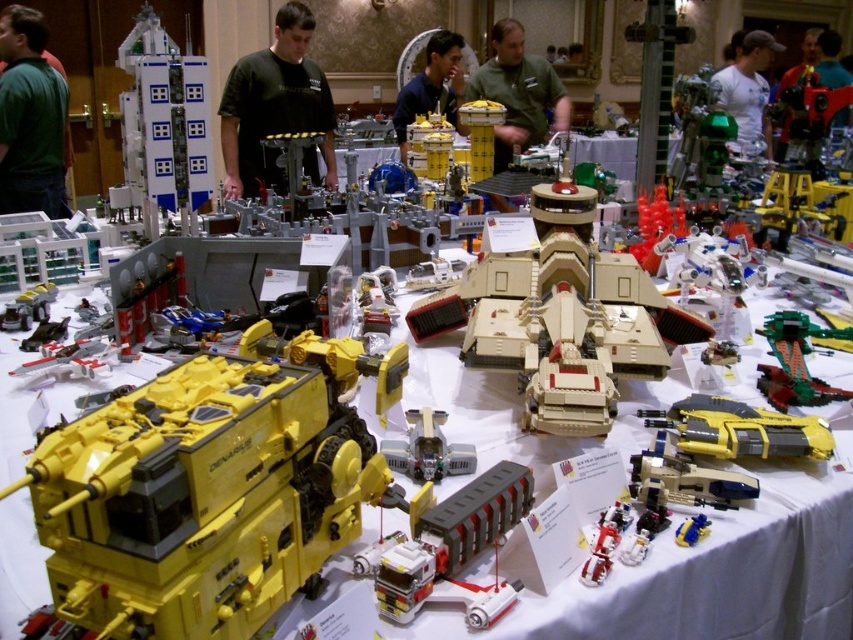
You are standing at the entrance of the LEGO exhibition hall and see two points marked on the floor. The first point is at coordinate point (415, 470) and the second is at point (595, 547). If you want to walk towards the wooden door in the background, which point should you aim for first?

You should aim for point (595, 547) first because point (415, 470) is behind point (595, 547), meaning point (595, 547) is closer to your current position at the entrance.

You are standing at the entrance of the LEGO exhibition hall. You see a point marked at coordinate [518,92]. According to the image, what object or area is located at that coordinate?

The point at coordinate [518,92] is located on the green matte shirt at center.

In the scene shown: You are organizing a LEGO exhibition and need to arrange shirts for participants. You have a green matte shirt at center and a white matte shirt at upper right. Which shirt should you choose if you need a larger one for a demonstration?

The white matte shirt at upper right is larger, so it should be chosen for the demonstration.